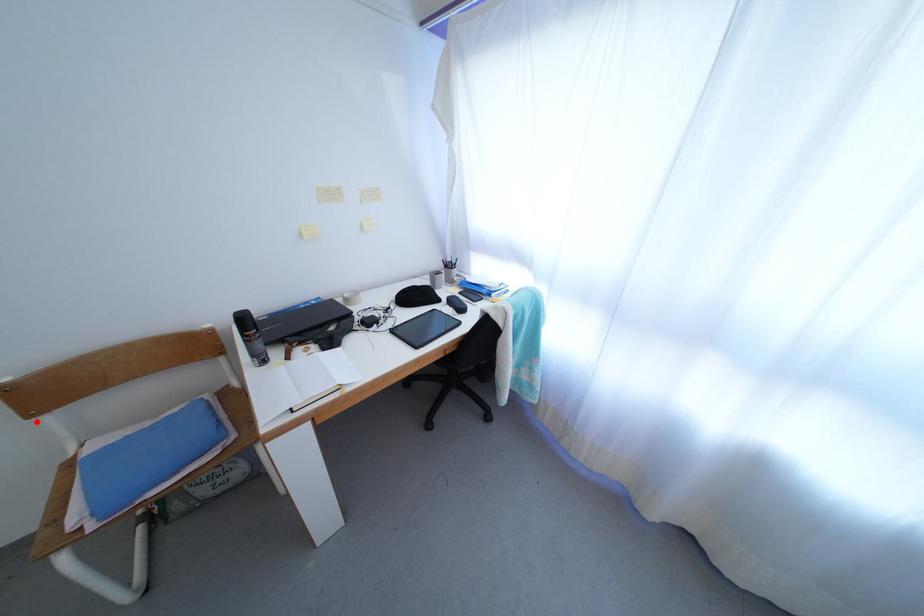
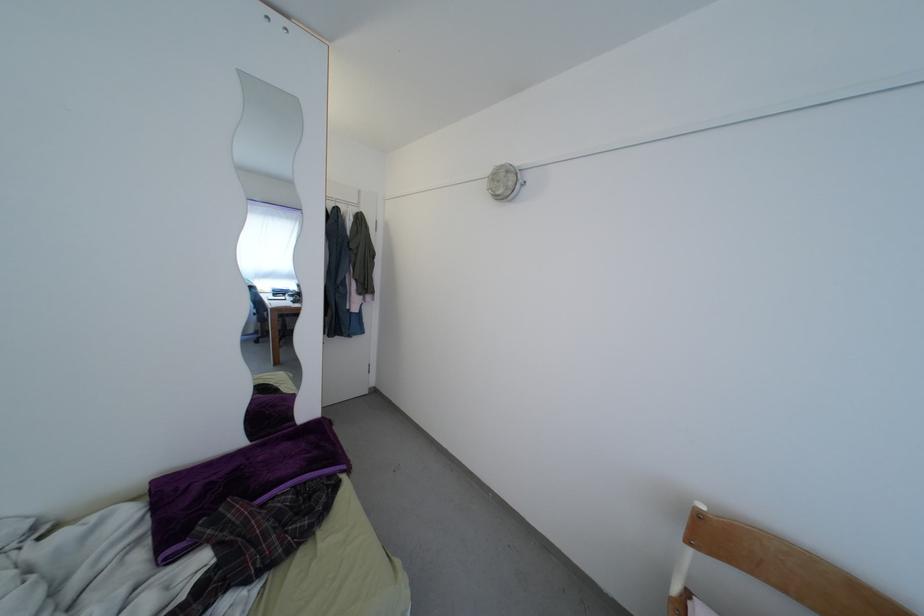
Locate, in the second image, the point that corresponds to the highlighted location in the first image.

(694, 548)